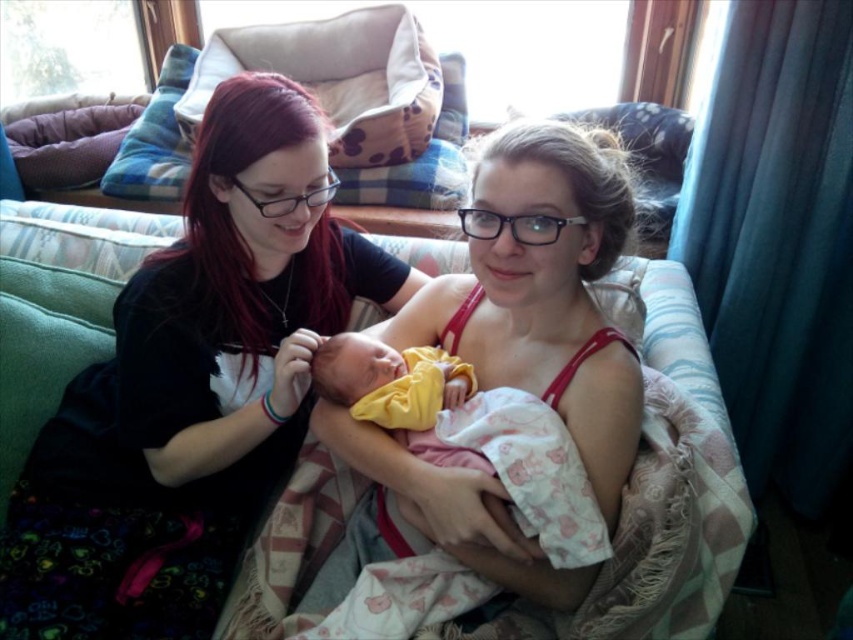
Between pink fabric baby at center and yellow fabric newborn at center, which one has less height?

Standing shorter between the two is yellow fabric newborn at center.

Is point (376, 548) less distant than point (492, 467)?

That is False.

Locate an element on the screen. This screenshot has width=853, height=640. pink fabric baby at center is located at coordinates (543, 289).

Based on the photo, is black matte shirt at upper left closer to camera compared to pink fabric baby at center?

No, black matte shirt at upper left is further to the viewer.

Between black matte shirt at upper left and pink fabric baby at center, which one is positioned higher?

Positioned higher is pink fabric baby at center.

The image size is (853, 640). I want to click on black matte shirt at upper left, so click(x=192, y=387).

Can you confirm if black matte shirt at upper left is positioned to the left of yellow fabric newborn at center?

Yes, black matte shirt at upper left is to the left of yellow fabric newborn at center.

Is point (252, 512) in front of point (398, 435)?

That is False.

Locate an element on the screen. The image size is (853, 640). black matte shirt at upper left is located at coordinates (192, 387).